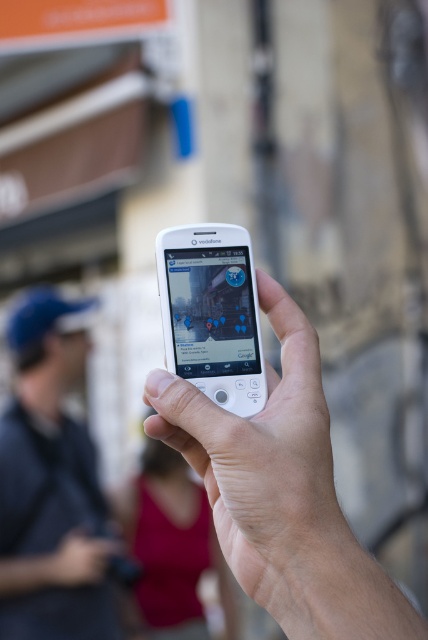
Question: Among these points, which one is farthest from the camera?

Choices:
 (A) 211,264
 (B) 67,621
 (C) 256,472

Answer: (B)

Question: Which point is farther to the camera?

Choices:
 (A) (240, 234)
 (B) (190, 436)

Answer: (A)

Question: Does white matte phone at center appear over white matte ipod at center?

Choices:
 (A) yes
 (B) no

Answer: (B)

Question: Observing the image, what is the correct spatial positioning of blue fabric cap at left in reference to white matte ipod at center?

Choices:
 (A) left
 (B) right

Answer: (A)

Question: Does blue fabric cap at left appear under white matte ipod at center?

Choices:
 (A) no
 (B) yes

Answer: (B)

Question: Which of these objects is positioned farthest from the white matte ipod at center?

Choices:
 (A) white matte phone at center
 (B) blue fabric cap at left

Answer: (B)